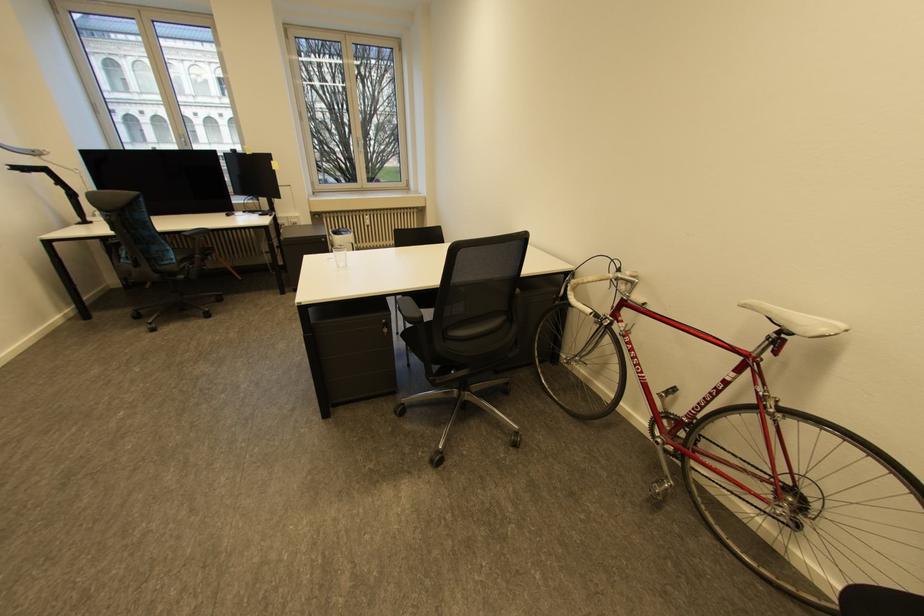
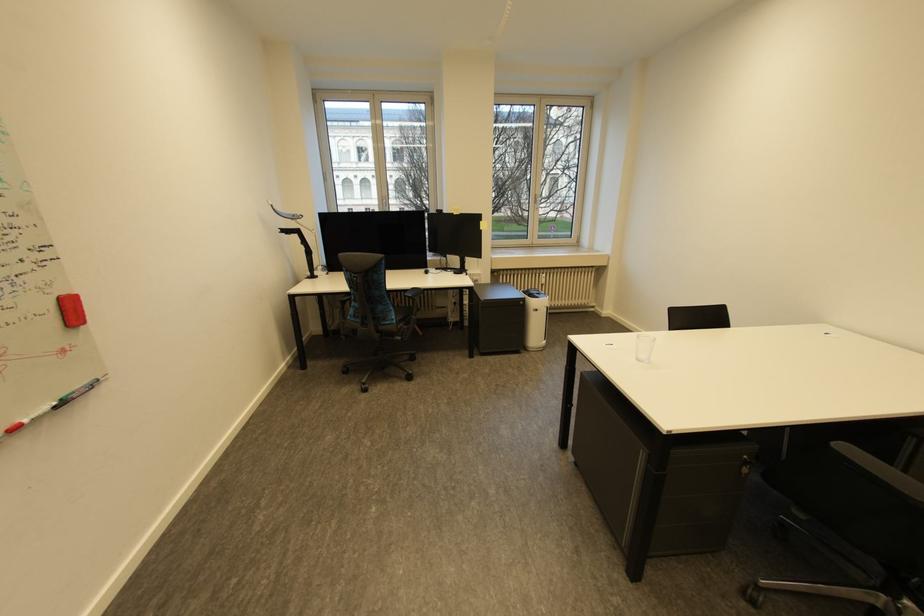
Find the pixel in the second image that matches (400,416) in the first image.

(750, 604)